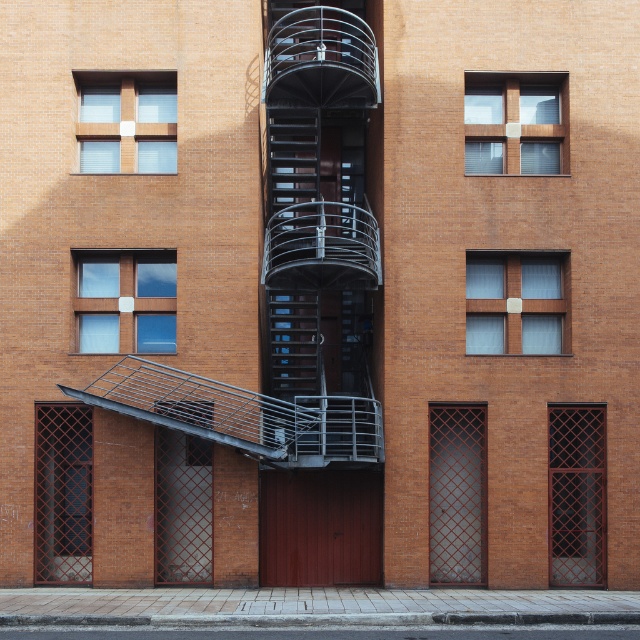
You are a delivery person trying to enter the building. You see a matte black door at lower left and a dark brown lattice door at right. Which door is shorter in height?

The matte black door at lower left is shorter in height than the dark brown lattice door at right.

Based on the photo, you are a delivery person carrying a package that requires a 6 meter wide path to pass through. You are standing in front of the building and see the matte black door at lower left and the dark brown lattice door at right. Can you determine if the space between these two doors is wide enough for your package to pass through?

The matte black door at lower left and the dark brown lattice door at right are 6.28 meters apart from each other, which is wider than the required 6 meter path. Therefore, the package can pass through the space between them.

Based on the photo, you are standing in front of the brick building and want to enter through the matte black door at lower left. There is a wooden frame at upper center above it. Which object is closer to you?

The matte black door at lower left is closer to the viewer than the wooden frame at upper center.